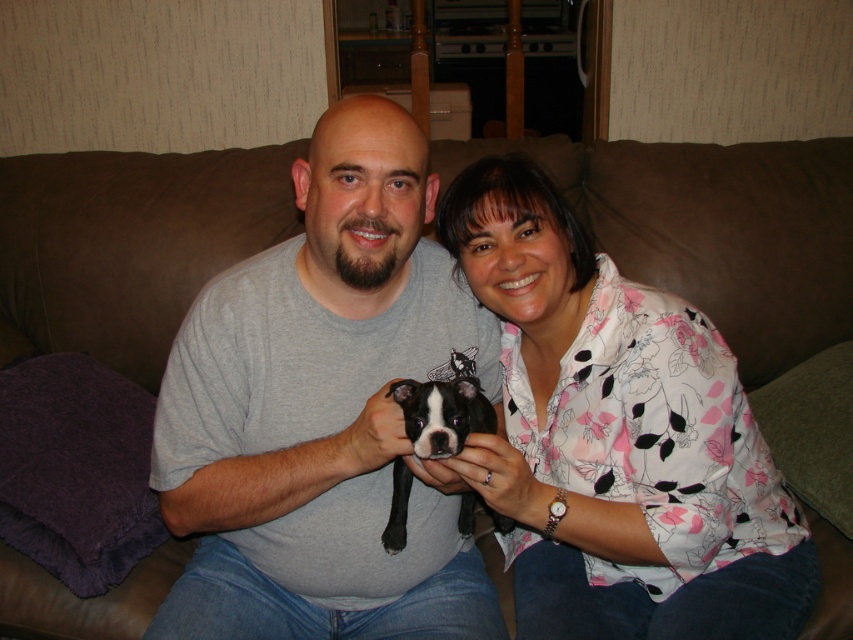
Which of these two, gray cotton shirt at center or jeans at center, stands shorter?

jeans at center

Between gray cotton shirt at center and jeans at center, which one has more height?

gray cotton shirt at center

Who is more forward, (426, 333) or (463, 614)?

Point (463, 614) is more forward.

This screenshot has height=640, width=853. I want to click on gray cotton shirt at center, so click(x=323, y=412).

Based on the photo, between gray cotton shirt at center and black fur dog at center, which one has more height?

Standing taller between the two is gray cotton shirt at center.

Which is more to the right, gray cotton shirt at center or black fur dog at center?

Positioned to the right is black fur dog at center.

Image resolution: width=853 pixels, height=640 pixels. Describe the element at coordinates (323, 412) in the screenshot. I see `gray cotton shirt at center` at that location.

Locate an element on the screen. The height and width of the screenshot is (640, 853). gray cotton shirt at center is located at coordinates (323, 412).

Who is lower down, jeans at center or black fur dog at center?

Positioned lower is jeans at center.

Describe the element at coordinates (320, 605) in the screenshot. The height and width of the screenshot is (640, 853). I see `jeans at center` at that location.

This screenshot has width=853, height=640. I want to click on jeans at center, so click(320, 605).